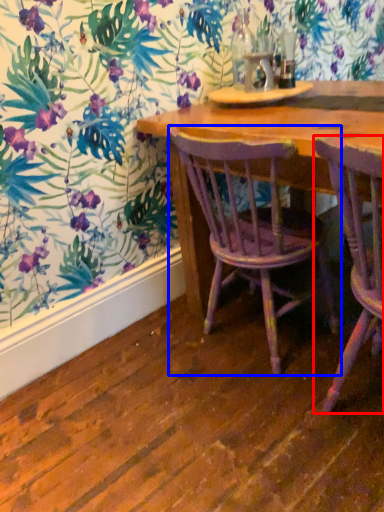
Question: Which object is closer to the camera taking this photo, chair (highlighted by a red box) or chair (highlighted by a blue box)?

Choices:
 (A) chair
 (B) chair

Answer: (A)